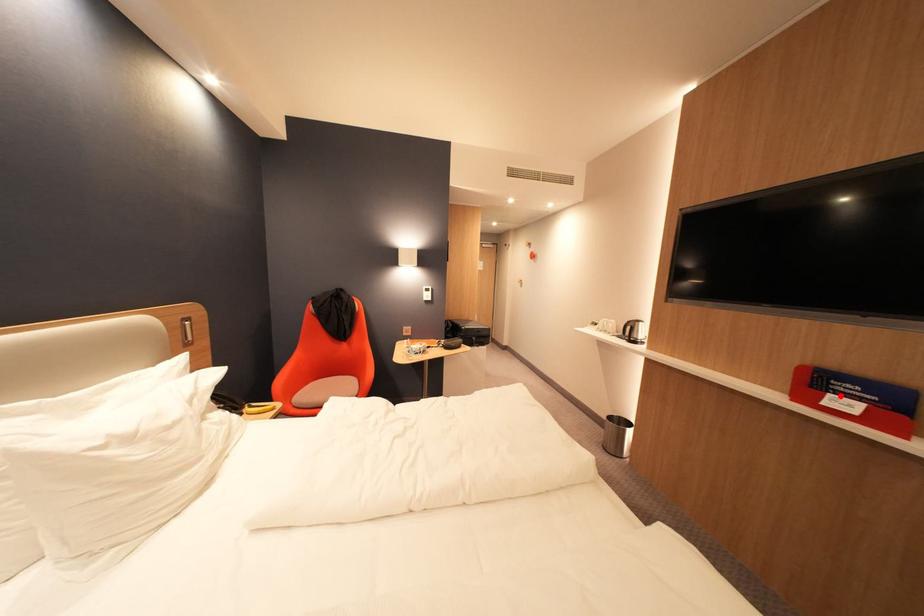
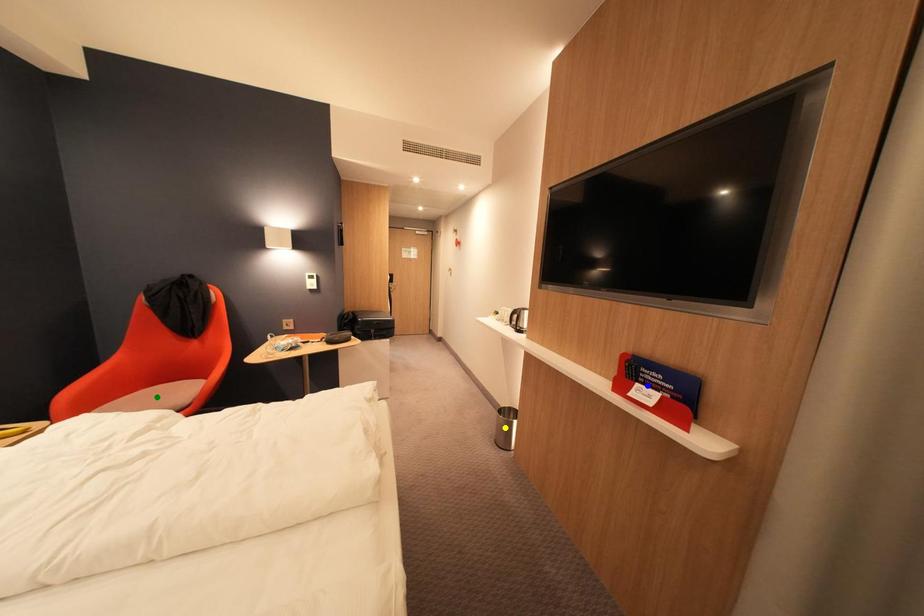
Question: I am providing you with two images of the same scene from different viewpoints. A red point is marked on the first image. You are given multiple points on the second image. In image 2, which mark is for the same physical point as the one in image 1?

Choices:
 (A) green point
 (B) blue point
 (C) yellow point

Answer: (B)